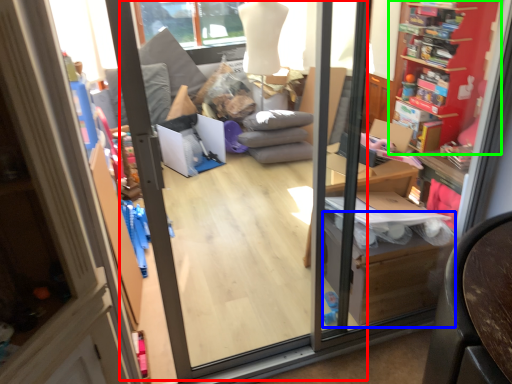
Question: Estimate the real-world distances between objects in this image. Which object is closer to screen door (highlighted by a red box), cardboard box (highlighted by a blue box) or shelf (highlighted by a green box)?

Choices:
 (A) cardboard box
 (B) shelf

Answer: (A)